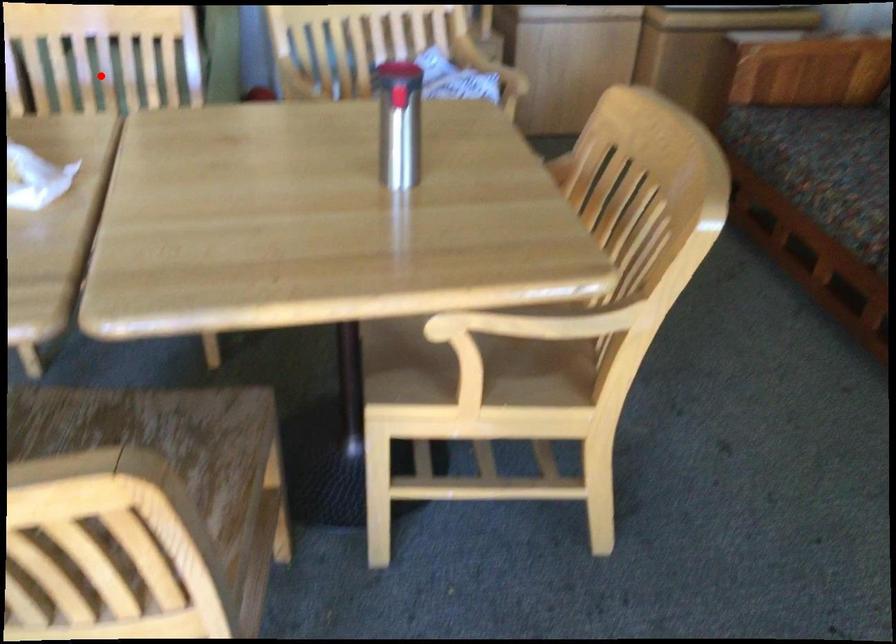
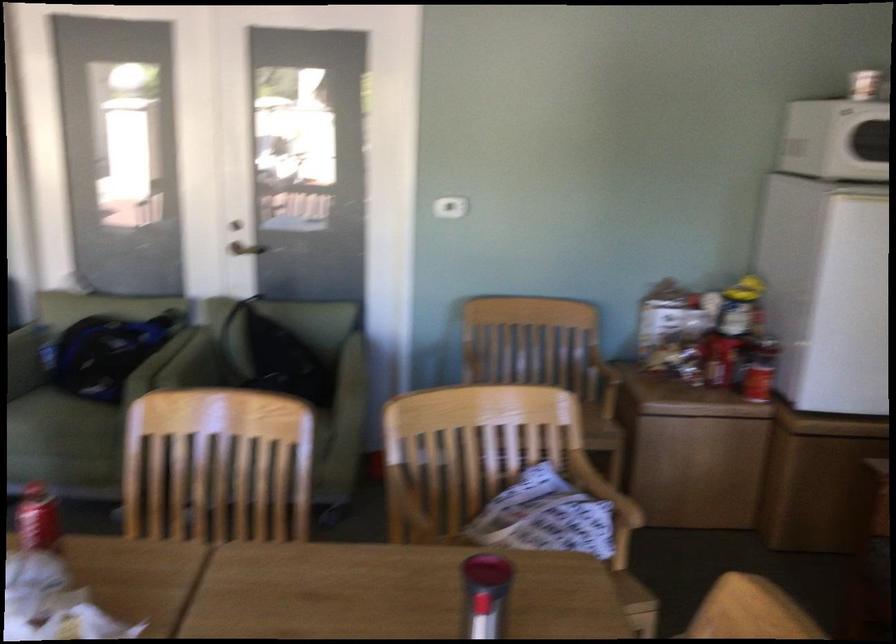
Where in the second image is the point corresponding to the highlighted location from the first image?

(217, 466)